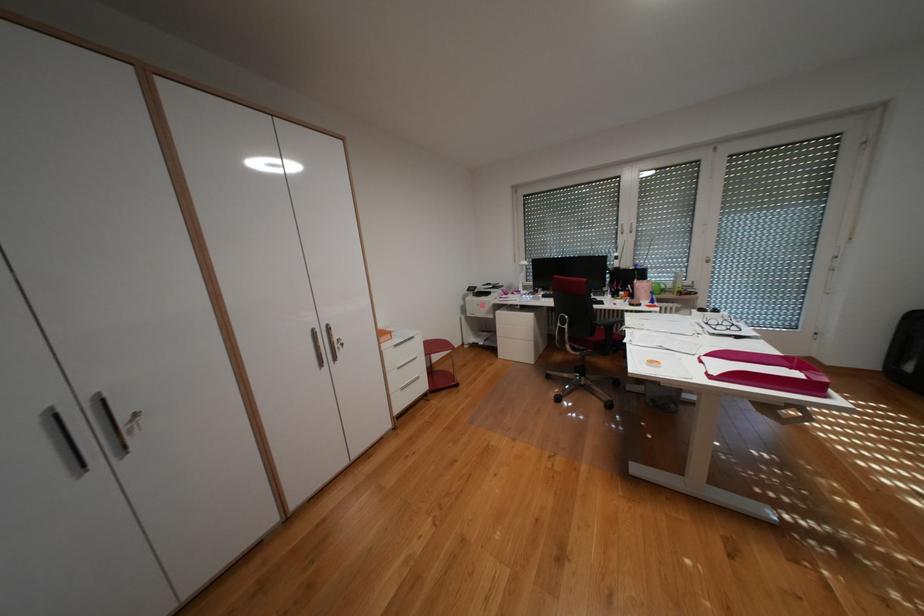
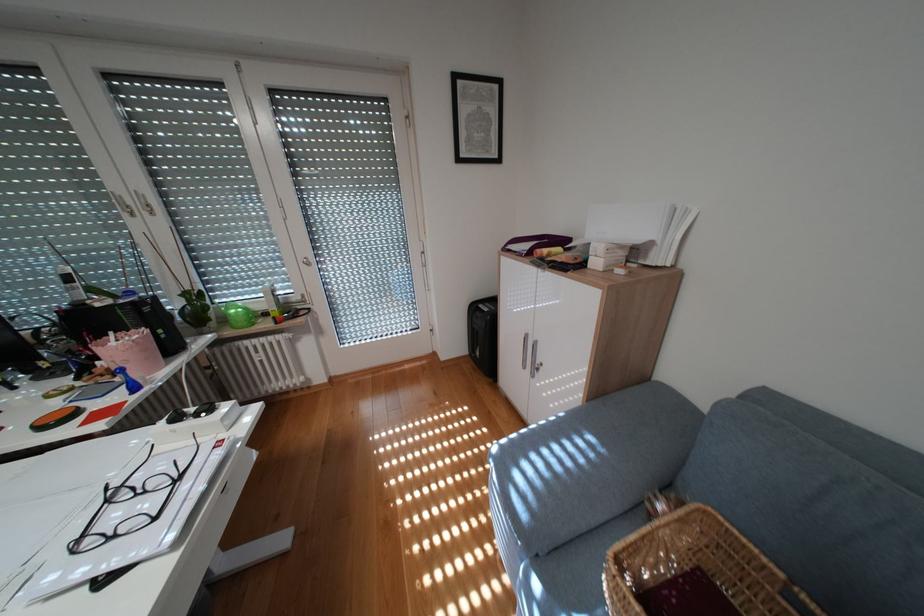
Where in the second image is the point corresponding to point 652,285 from the first image?

(136, 345)